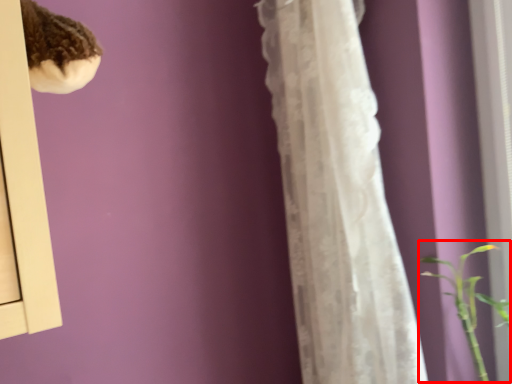
Question: In this image, where is orchid (annotated by the red box) located relative to curtain?

Choices:
 (A) left
 (B) right

Answer: (B)